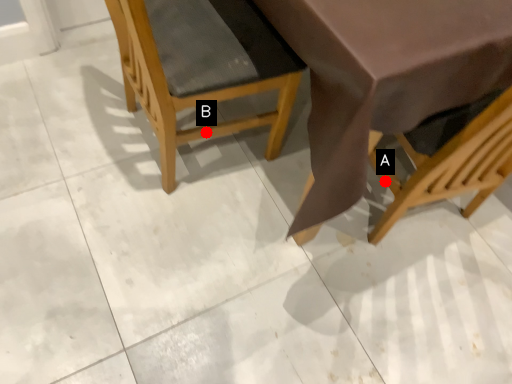
Question: Two points are circled on the image, labeled by A and B beside each circle. Which point is closer to the camera?

Choices:
 (A) A is closer
 (B) B is closer

Answer: (B)